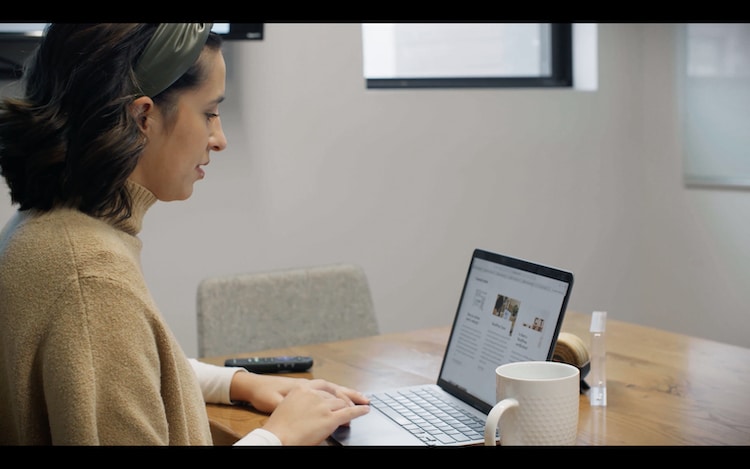
In order to click on window in this screenshot , I will do `click(442, 32)`.